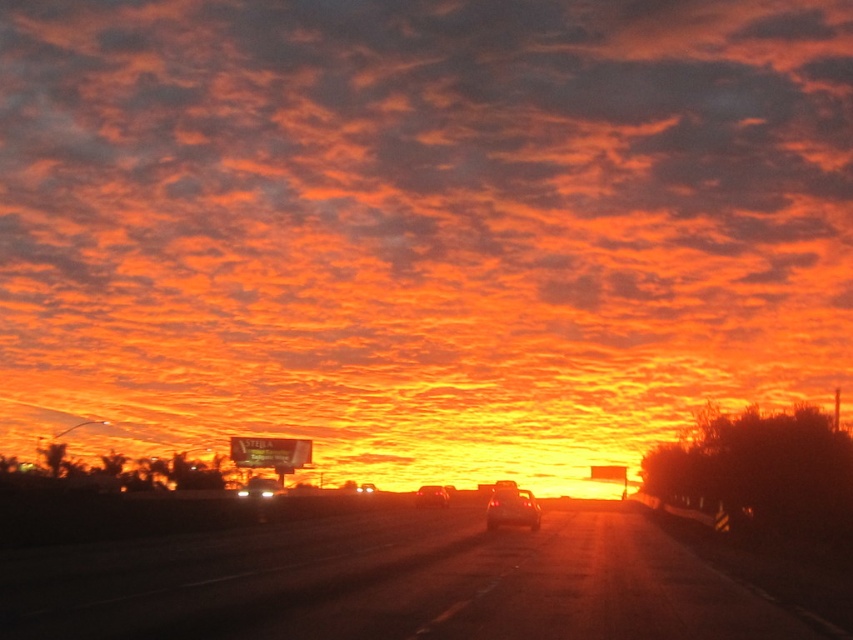
You are a drone operator who needs to land a drone on the smooth asphalt highway at center. The drone has a GPS coordinate of point (395,582). Is this point suitable for landing?

The point (395,582) indicates smooth asphalt highway at center, so yes, this point is suitable for landing the drone on the smooth asphalt highway at center.

You are a photographer trying to capture the sunset scene. You have two cars in your frame, the shiny metallic car at center and the shiny silver sedan at center. Which car appears closer to you based on their sizes?

The shiny metallic car at center appears closer because it is smaller than the shiny silver sedan at center, indicating it is farther away.

You are a pedestrian standing at the edge of the smooth asphalt highway at center. You see a shiny metallic car at center approaching you. If the car is moving at 10 meters per second, how many seconds will it take for the car to reach you?

The distance between the smooth asphalt highway at center and the shiny metallic car at center is 8.24 meters. Since the car is moving at 10 meters per second, it will take approximately 0.824 seconds to reach the pedestrian. However, this scenario is dangerous and pedestrians should never stand on highways.